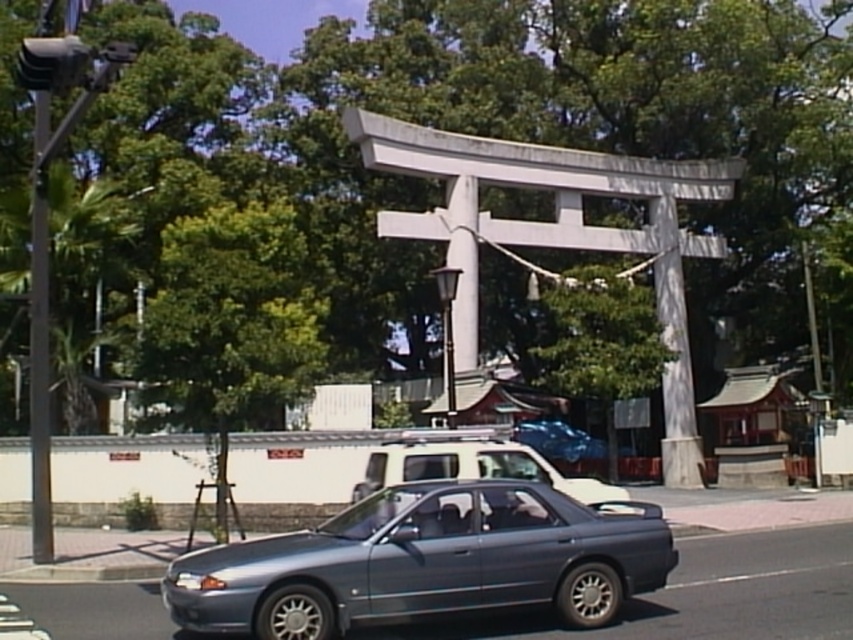
Question: Is satin metallic sedan at center closer to camera compared to metallic silver suv at center?

Choices:
 (A) no
 (B) yes

Answer: (B)

Question: Does satin metallic sedan at center have a greater width compared to metallic silver suv at center?

Choices:
 (A) no
 (B) yes

Answer: (B)

Question: In this image, where is satin metallic sedan at center located relative to metallic silver suv at center?

Choices:
 (A) above
 (B) below

Answer: (B)